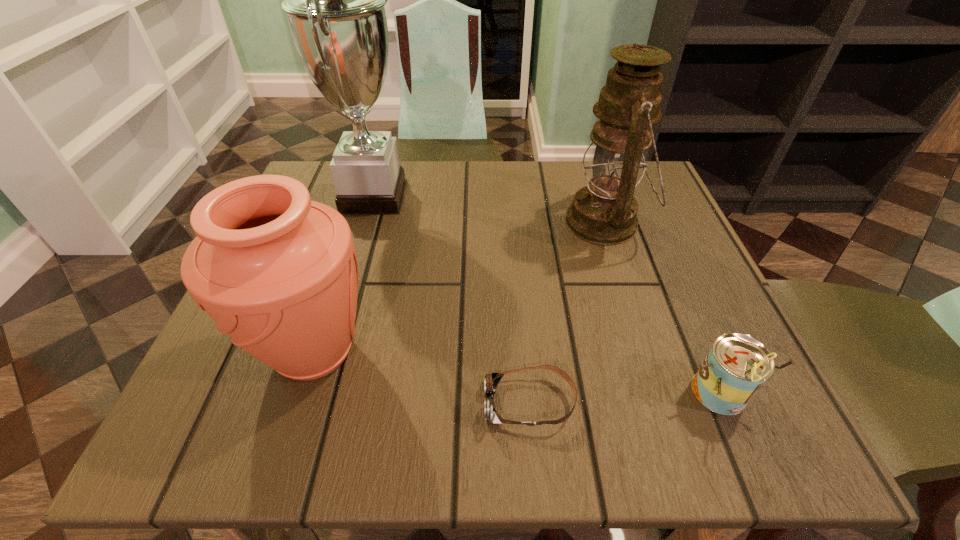
The width and height of the screenshot is (960, 540). I want to click on free location located 0.390m on the front-facing side of the third object from right to left, so click(213, 403).

Locate an element on the screen. The height and width of the screenshot is (540, 960). free point located 0.170m on the front-facing side of the third object from right to left is located at coordinates (366, 403).

In order to click on vacant position located on the front-facing side of the third object from right to left in this screenshot , I will do `click(338, 403)`.

Identify the location of trophy cup located at the far edge. (334, 0).

This screenshot has height=540, width=960. Identify the location of oil lamp that is positioned at the far edge. point(605,212).

Find the location of `vase situated at the near edge`. vase situated at the near edge is located at coordinates (278, 273).

What are the coordinates of `can located at the near edge` in the screenshot? It's located at (736, 367).

Locate an element on the screen. This screenshot has width=960, height=540. goggles present at the near edge is located at coordinates (490, 383).

Find the location of a particular element. The height and width of the screenshot is (540, 960). trophy cup that is at the left edge is located at coordinates (334, 0).

Locate an element on the screen. The image size is (960, 540). vase that is at the left edge is located at coordinates (278, 273).